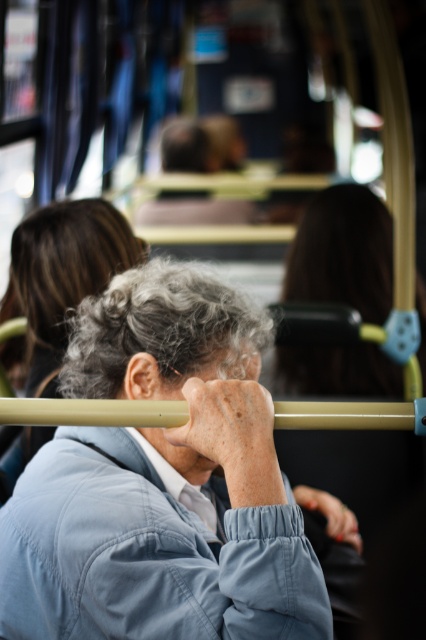
Question: Which of the following is the farthest from the observer?

Choices:
 (A) gray matte hair at center
 (B) light blue fabric jacket at center

Answer: (A)

Question: Can you confirm if dark brown hair at upper center is smaller than gray matte hair at center?

Choices:
 (A) no
 (B) yes

Answer: (A)

Question: Which of these objects is positioned closest to the dark brown hair at upper center?

Choices:
 (A) gray matte hair at center
 (B) light blue fabric jacket at center
 (C) light blue fabric at center

Answer: (C)

Question: Is dark brown hair at upper center thinner than light blue fabric at center?

Choices:
 (A) no
 (B) yes

Answer: (A)

Question: Which point appears farthest from the camera in this image?

Choices:
 (A) (31, 294)
 (B) (241, 330)

Answer: (A)

Question: Can you confirm if dark brown hair at upper center is thinner than gray matte hair at center?

Choices:
 (A) no
 (B) yes

Answer: (A)